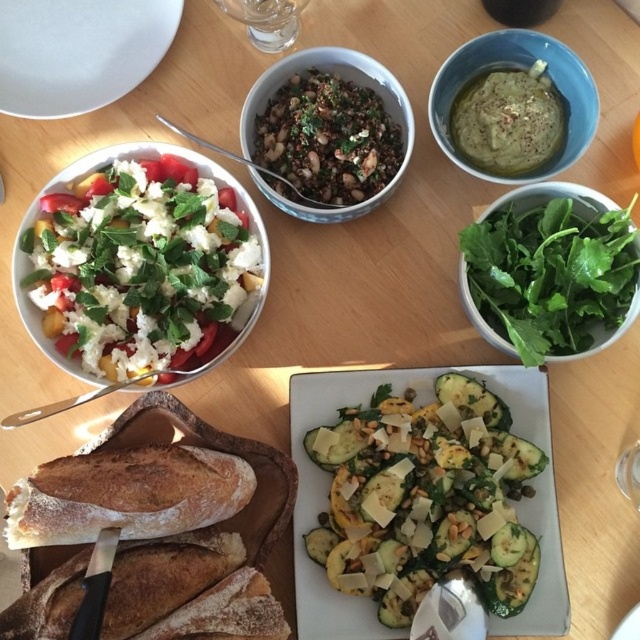
You are a photographer trying to capture the best shot of the table. You notice two points marked on the table surface at coordinates point (552, 252) and point (108, 483). Which point should you focus on to ensure it appears closer in the photo?

You should focus on point (552, 252) because it is further to the camera than point (108, 483), making it appear closer in the photo.

You are a chef arranging dishes on a table. You have a grilled zucchini at center and a green matte hummus at upper right. Which dish has a larger width?

The grilled zucchini at center might be wider than the green matte hummus at upper right, so it is possible that the grilled zucchini at center has a larger width.

You are a guest at a dinner and want to reach for the green leafy salad at upper right and the white matte plate at upper left. Based on their positions, which one is closer to your right hand?

The green leafy salad at upper right is to the right of the white matte plate at upper left, so it is closer to your right hand.